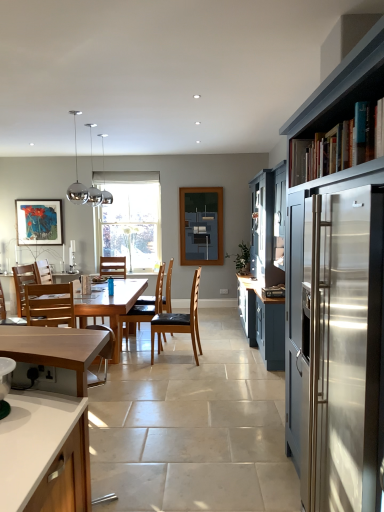
Describe the element at coordinates (201, 225) in the screenshot. I see `matte black artwork at center` at that location.

Locate an element on the screen. The image size is (384, 512). matte glass picture frame at upper left is located at coordinates (39, 222).

What is the approximate width of blue painted wood bookshelf at upper right?

blue painted wood bookshelf at upper right is 9.24 inches wide.

What are the coordinates of `brown leather chair at center, which is the 4th chair from front to back` in the screenshot? It's located at (144, 308).

The width and height of the screenshot is (384, 512). I want to click on light brown wood countertop at lower left, the 2th cabinetry from the right, so click(x=54, y=348).

Measure the distance between point (x=62, y=333) and camera.

2.22 meters.

The image size is (384, 512). Find the location of `matte dark blue cabinet at right, the 2th cabinetry viewed from the left`. matte dark blue cabinet at right, the 2th cabinetry viewed from the left is located at coordinates (337, 287).

Where is `matte black artwork at center`? Image resolution: width=384 pixels, height=512 pixels. matte black artwork at center is located at coordinates (201, 225).

Considering the positions of objects blue painted wood bookshelf at upper right and wooden chair at center, the fifth chair viewed from the front, in the image provided, who is in front, blue painted wood bookshelf at upper right or wooden chair at center, the fifth chair viewed from the front,?

blue painted wood bookshelf at upper right is more forward.

From a real-world perspective, which is physically above, blue painted wood bookshelf at upper right or wooden chair at center, the fifth chair viewed from the front?

blue painted wood bookshelf at upper right is physically above.

Based on the photo, from the image's perspective, does blue painted wood bookshelf at upper right appear higher than wooden chair at center, which is the 1th chair in back-to-front order?

Yes.

Which point is more forward, (381, 98) or (118, 269)?

The point (381, 98) is closer to the camera.

Is wooden chair at center, the 5th chair from the back, surrounded by wooden chair at center, which is the 1th chair in back-to-front order?

No.

From the image's perspective, which is below, wooden chair at center, which is the 1th chair in back-to-front order, or wooden chair at center, the 5th chair from the back?

wooden chair at center, the 5th chair from the back.

Considering the relative positions of wooden chair at center, which is the 1th chair in back-to-front order, and wooden chair at center, the 5th chair from the back, in the image provided, is wooden chair at center, which is the 1th chair in back-to-front order, to the right of wooden chair at center, the 5th chair from the back, from the viewer's perspective?

Yes, wooden chair at center, which is the 1th chair in back-to-front order, is to the right of wooden chair at center, the 5th chair from the back.

Is matte glass picture frame at upper left positioned behind light brown wood countertop at lower left, the 2th cabinetry from the right?

Yes, the depth of matte glass picture frame at upper left is greater than that of light brown wood countertop at lower left, the 2th cabinetry from the right.

Are matte glass picture frame at upper left and light brown wood countertop at lower left, the 2th cabinetry from the right, far apart?

Yes.

Between matte glass picture frame at upper left and light brown wood countertop at lower left, arranged as the 1th cabinetry when viewed from the left, which one appears on the left side from the viewer's perspective?

Positioned to the left is matte glass picture frame at upper left.

Is matte glass picture frame at upper left shorter than light brown wood countertop at lower left, arranged as the 1th cabinetry when viewed from the left?

Yes.

Does matte black artwork at center have a lesser height compared to wooden chair at center, the first chair from the front?

No, matte black artwork at center is not shorter than wooden chair at center, the first chair from the front.

You are a GUI agent. You are given a task and a screenshot of the screen. Output one action in this format:
    pyautogui.click(x=<x>, y=<y>)
    Task: Click on the chair that is the 2nd one below the matte black artwork at center (from a real-world perspective)
    
    Given the screenshot: What is the action you would take?
    pyautogui.click(x=43, y=298)

Can you tell me how much matte black artwork at center and wooden chair at center, the first chair from the front, differ in facing direction?

There is a 167-degree angle between the facing directions of matte black artwork at center and wooden chair at center, the first chair from the front.

Based on the photo, is matte black artwork at center facing away from wooden chair at center, the first chair from the front?

No.

From the image's perspective, between wooden chair at center, the first chair from the front, and matte black artwork at center, which one is located above?

matte black artwork at center is shown above in the image.

Is wooden chair at center, the 5th chair from the back, at the right side of matte black artwork at center?

No, wooden chair at center, the 5th chair from the back, is not to the right of matte black artwork at center.

Is wooden chair at center, the 5th chair from the back, aimed at matte black artwork at center?

No, wooden chair at center, the 5th chair from the back, is not aimed at matte black artwork at center.

Is point (43, 301) closer to camera compared to point (208, 234)?

That is True.

How different are the orientations of matte black artwork at center and wooden chair at center, which is the 1th chair in back-to-front order, in degrees?

1.51 degrees separate the facing orientations of matte black artwork at center and wooden chair at center, which is the 1th chair in back-to-front order.

Looking at this image, between matte black artwork at center and wooden chair at center, which is the 1th chair in back-to-front order, which one appears on the left side from the viewer's perspective?

Positioned to the left is wooden chair at center, which is the 1th chair in back-to-front order.

Is matte black artwork at center thinner than wooden chair at center, the fifth chair viewed from the front?

Correct, the width of matte black artwork at center is less than that of wooden chair at center, the fifth chair viewed from the front.

From the image's perspective, is matte black artwork at center located above or below wooden chair at center, the fifth chair viewed from the front?

matte black artwork at center is above wooden chair at center, the fifth chair viewed from the front.

Which object is thinner, blue painted wood bookshelf at upper right or clear glass window at center?

Thinner between the two is clear glass window at center.

Where is `window located on the left of blue painted wood bookshelf at upper right`? This screenshot has height=512, width=384. window located on the left of blue painted wood bookshelf at upper right is located at coordinates (130, 219).

Is blue painted wood bookshelf at upper right in front of clear glass window at center?

Yes.

How different are the orientations of blue painted wood bookshelf at upper right and clear glass window at center in degrees?

90.3 degrees.

You are a GUI agent. You are given a task and a screenshot of the screen. Output one action in this format:
    pyautogui.click(x=<x>, y=<y>)
    Task: Click on the shelf positioned vertically above the wooden chair at center, the fifth chair viewed from the front (from a real-world perspective)
    This screenshot has width=384, height=512.
    Given the screenshot: What is the action you would take?
    pyautogui.click(x=339, y=145)

The image size is (384, 512). There is a wooden chair at center, which is the 1th chair in back-to-front order. What are the coordinates of `the 1st chair below it (from a real-world perspective)` in the screenshot? It's located at (43, 298).

From the image, which object appears to be nearer to wooden chair at center, which is the 1th chair in back-to-front order, matte glass picture frame at upper left or matte black artwork at center?

matte glass picture frame at upper left.

Based on their spatial positions, is matte black artwork at center or matte glass picture frame at upper left closer to wooden chair at center, the 5th chair from the back?

The object closer to wooden chair at center, the 5th chair from the back, is matte glass picture frame at upper left.

Considering their positions, is brown leather chair at center, arranged as the third chair when viewed from the front, positioned further to light brown wooden chair at center, which ranks as the 2th chair in front-to-back order, than matte black artwork at center?

matte black artwork at center is further to light brown wooden chair at center, which ranks as the 2th chair in front-to-back order.

From the image, which object appears to be farther from brown leather chair at center, arranged as the third chair when viewed from the front, brown leather chair at center or matte dark blue cabinet at right, the 2th cabinetry viewed from the left?

matte dark blue cabinet at right, the 2th cabinetry viewed from the left, is further to brown leather chair at center, arranged as the third chair when viewed from the front.

From the image, which object appears to be farther from matte glass picture frame at upper left, wooden chair at center, which is the 1th chair in back-to-front order, or light brown wooden chair at center, which ranks as the 2th chair in front-to-back order?

Based on the image, light brown wooden chair at center, which ranks as the 2th chair in front-to-back order, appears to be further to matte glass picture frame at upper left.

From the image, which object appears to be nearer to brown leather chair at center, wooden chair at center, the first chair from the front, or light brown wood countertop at lower left, the 2th cabinetry from the right?

Among the two, wooden chair at center, the first chair from the front, is located nearer to brown leather chair at center.

Looking at the image, which one is located closer to light brown wood countertop at lower left, the 2th cabinetry from the right, clear glass window at center or matte dark blue cabinet at right, arranged as the first cabinetry when viewed from the right?

matte dark blue cabinet at right, arranged as the first cabinetry when viewed from the right.

From the image, which object appears to be farther from matte black artwork at center, matte glass picture frame at upper left or clear glass window at center?

matte glass picture frame at upper left is further to matte black artwork at center.

The image size is (384, 512). I want to click on window between matte glass picture frame at upper left and brown leather chair at center in the horizontal direction, so click(x=130, y=219).

Locate an element on the screen. chair between light brown wood countertop at lower left, the 2th cabinetry from the right, and light brown wooden chair at center, which ranks as the 2th chair in front-to-back order, along the z-axis is located at coordinates (43, 298).

Image resolution: width=384 pixels, height=512 pixels. Find the location of `chair between blue painted wood bookshelf at upper right and light brown wooden chair at center, which ranks as the fourth chair in back-to-front order, in the front-back direction`. chair between blue painted wood bookshelf at upper right and light brown wooden chair at center, which ranks as the fourth chair in back-to-front order, in the front-back direction is located at coordinates (43, 298).

Find the location of a particular element. cabinetry positioned between blue painted wood bookshelf at upper right and matte glass picture frame at upper left from near to far is located at coordinates (54, 348).